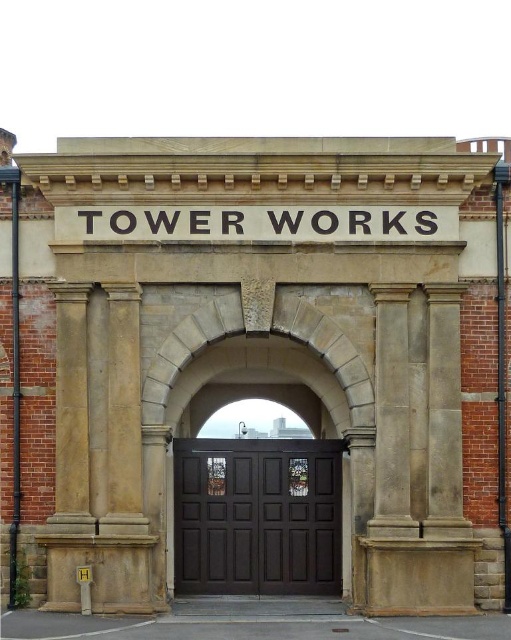
Question: Which point appears farthest from the camera in this image?

Choices:
 (A) (286, 524)
 (B) (350, 218)

Answer: (A)

Question: Is dark wood door at center further to the viewer compared to black stone sign at center?

Choices:
 (A) yes
 (B) no

Answer: (A)

Question: Which object is closer to the camera taking this photo?

Choices:
 (A) dark wood door at center
 (B) black stone sign at center

Answer: (B)

Question: Which point appears farthest from the camera in this image?

Choices:
 (A) (262, 209)
 (B) (312, 541)

Answer: (B)

Question: Can you confirm if dark wood door at center is positioned to the right of black stone sign at center?

Choices:
 (A) yes
 (B) no

Answer: (B)

Question: Is dark wood door at center smaller than black stone sign at center?

Choices:
 (A) no
 (B) yes

Answer: (A)